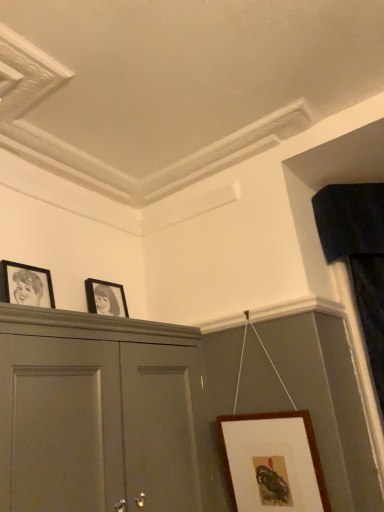
Question: Is matte black picture frame at upper center, the second picture frame from the top, behind velvet dark blue curtain at right?

Choices:
 (A) no
 (B) yes

Answer: (B)

Question: From a real-world perspective, does matte black picture frame at upper center, the second picture frame from the top, sit lower than velvet dark blue curtain at right?

Choices:
 (A) yes
 (B) no

Answer: (B)

Question: Would you say matte black picture frame at upper center, which is the 2th picture frame in bottom-to-top order, is outside velvet dark blue curtain at right?

Choices:
 (A) no
 (B) yes

Answer: (B)

Question: Is matte black picture frame at upper center, which is counted as the 2th picture frame, starting from the right, aimed at velvet dark blue curtain at right?

Choices:
 (A) yes
 (B) no

Answer: (B)

Question: Can you confirm if matte black picture frame at upper center, which is the 2th picture frame in bottom-to-top order, is wider than velvet dark blue curtain at right?

Choices:
 (A) no
 (B) yes

Answer: (A)

Question: Based on their positions, is velvet dark blue curtain at right located to the left or right of matte black picture frame at upper center, the second picture frame from the top?

Choices:
 (A) right
 (B) left

Answer: (A)

Question: From the image's perspective, relative to matte black picture frame at upper center, the second picture frame from the top, is velvet dark blue curtain at right above or below?

Choices:
 (A) above
 (B) below

Answer: (A)

Question: From a real-world perspective, is velvet dark blue curtain at right above or below matte black picture frame at upper center, placed as the 2th picture frame when sorted from left to right?

Choices:
 (A) above
 (B) below

Answer: (B)

Question: Considering the positions of velvet dark blue curtain at right and matte black picture frame at upper center, which is counted as the 2th picture frame, starting from the right, in the image, is velvet dark blue curtain at right taller or shorter than matte black picture frame at upper center, which is counted as the 2th picture frame, starting from the right,?

Choices:
 (A) short
 (B) tall

Answer: (B)

Question: Considering the positions of matte gray cabinet at upper left and velvet dark blue curtain at right in the image, is matte gray cabinet at upper left taller or shorter than velvet dark blue curtain at right?

Choices:
 (A) short
 (B) tall

Answer: (A)

Question: Based on their sizes in the image, would you say matte gray cabinet at upper left is bigger or smaller than velvet dark blue curtain at right?

Choices:
 (A) big
 (B) small

Answer: (A)

Question: From the image's perspective, relative to velvet dark blue curtain at right, is matte gray cabinet at upper left above or below?

Choices:
 (A) above
 (B) below

Answer: (B)

Question: Is matte gray cabinet at upper left wider or thinner than velvet dark blue curtain at right?

Choices:
 (A) thin
 (B) wide

Answer: (B)

Question: In the image, is matte gray cabinet at upper left on the left side or the right side of brown wooden picture frame at lower right, the third picture frame when ordered from top to bottom?

Choices:
 (A) right
 (B) left

Answer: (B)

Question: Choose the correct answer: Is matte gray cabinet at upper left inside brown wooden picture frame at lower right, which is the first picture frame in right-to-left order, or outside it?

Choices:
 (A) outside
 (B) inside

Answer: (A)